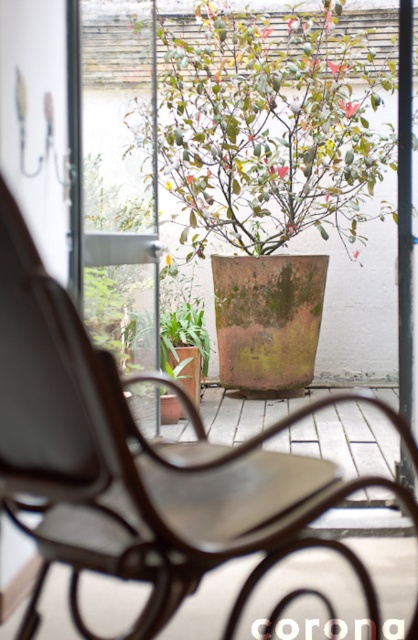
You are standing in a room and see a rustic wood rocking chair at center through a glass door. If you want to reach the chair, how many steps would you need to take if each step covers 1.25 feet?

The rustic wood rocking chair at center is 3.77 feet away from the viewer. Since each step covers 1.25 feet, dividing 3.77 by 1.25 gives approximately 3 steps needed to reach the chair.

You are standing in a room looking through a glass door. You see a rustic wood rocking chair at center and a green matte pot at center. Which object is closer to the left side of the door?

The rustic wood rocking chair at center is closer to the left side of the door because it is positioned to the left of the green matte pot at center.

You are a guest entering through the glass door and see the rustic wood rocking chair at center and the green matte pot at center. Which object is taller?

The green matte pot at center is taller than the rustic wood rocking chair at center.